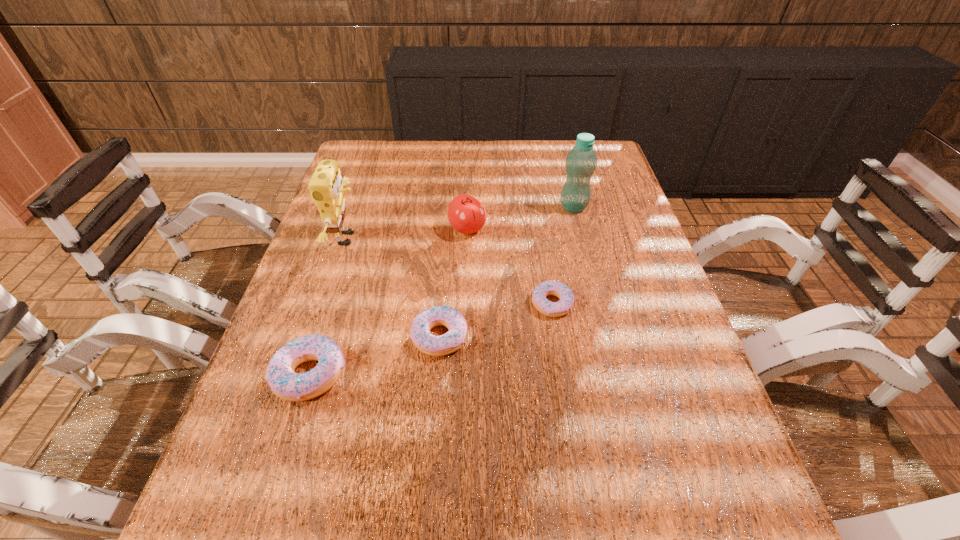
Identify the location of free space at the left edge of the desktop. This screenshot has width=960, height=540. click(x=371, y=232).

Locate an element on the screen. This screenshot has height=540, width=960. free spot at the right edge of the desktop is located at coordinates (624, 254).

Where is `vacant area at the far right corner of the desktop`? The height and width of the screenshot is (540, 960). vacant area at the far right corner of the desktop is located at coordinates (564, 142).

Find the location of a particular element. The image size is (960, 540). empty space that is in between the third tallest object and the sponge is located at coordinates (408, 234).

I want to click on unoccupied area between the apple and the sponge, so click(408, 234).

You are a GUI agent. You are given a task and a screenshot of the screen. Output one action in this format:
    pyautogui.click(x=<x>, y=<y>)
    Task: Click on the empty location between the water bottle and the fourth shortest object
    This screenshot has width=960, height=540.
    Given the screenshot: What is the action you would take?
    pyautogui.click(x=520, y=218)

Locate an element on the screen. Image resolution: width=960 pixels, height=540 pixels. unoccupied position between the rightmost doughnut and the second tallest doughnut is located at coordinates (496, 320).

Identify the location of vacant area that lies between the shortest object and the rightmost object. The width and height of the screenshot is (960, 540). (563, 255).

At what (x,y) coordinates should I click in order to perform the action: click on vacant space in between the third tallest object and the second doughnut from left to right. Please return your answer as a coordinate pair (x, y). The image size is (960, 540). Looking at the image, I should click on (454, 283).

Locate an element on the screen. This screenshot has height=540, width=960. blank region between the leftmost doughnut and the second doughnut from right to left is located at coordinates (375, 356).